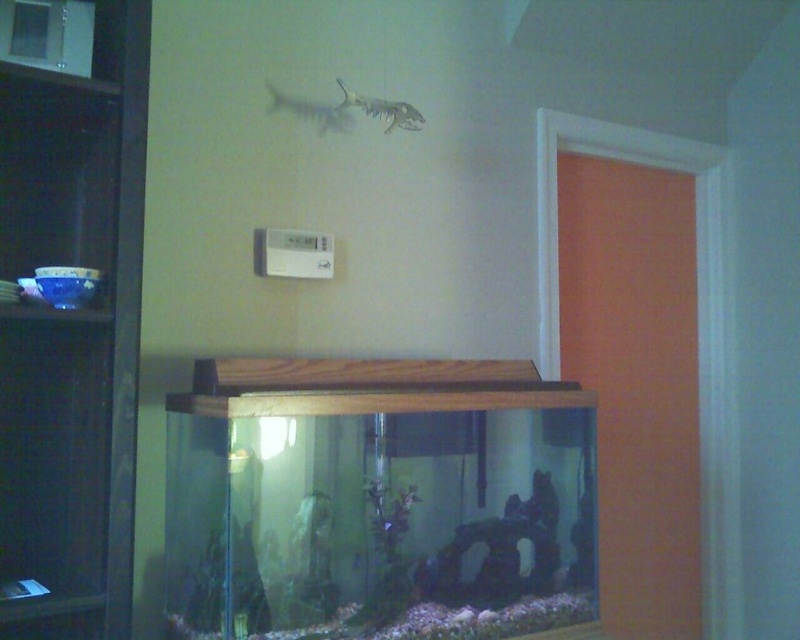
Does point (108, 186) lie in front of point (368, 100)?

Yes, it is in front of point (368, 100).

Locate an element on the screen. dark wood bookshelf at left is located at coordinates (72, 330).